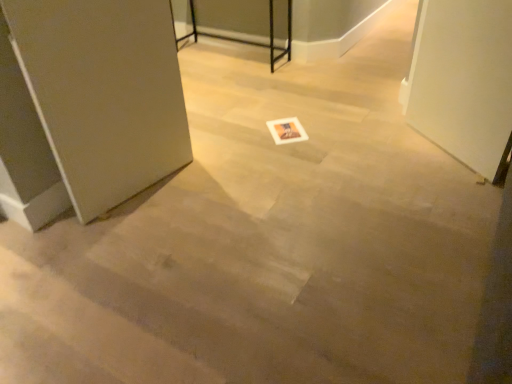
Find the location of a particular element. Image resolution: width=512 pixels, height=384 pixels. free space in front of white paper postcard at center is located at coordinates (289, 149).